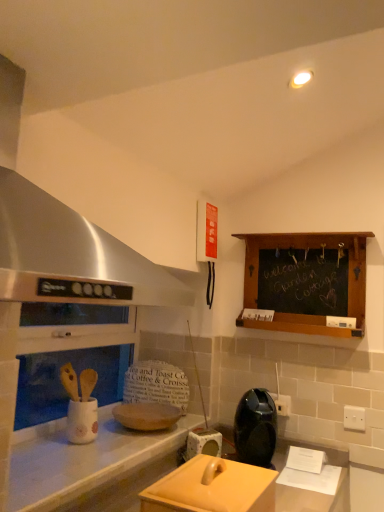
How much space does black plastic electric outlet at center-right, which appears as the second electric outlet when viewed from the right, occupy vertically?

black plastic electric outlet at center-right, which appears as the second electric outlet when viewed from the right, is 2.73 inches tall.

Describe the element at coordinates (282, 404) in the screenshot. I see `black plastic electric outlet at center-right, the first electric outlet in the back-to-front sequence` at that location.

How much space does white plastic electric outlet at upper right, the second electric outlet in the back-to-front sequence, occupy horizontally?

The width of white plastic electric outlet at upper right, the second electric outlet in the back-to-front sequence, is 0.89 inches.

What do you see at coordinates (354, 418) in the screenshot? I see `white plastic electric outlet at upper right, the second electric outlet in the back-to-front sequence` at bounding box center [354, 418].

What do you see at coordinates (255, 428) in the screenshot? I see `black glossy coffee maker at center, acting as the second appliance starting from the front` at bounding box center [255, 428].

Based on the photo, in order to face chalkboard wood at upper right, should I rotate leftwards or rightwards?

You should rotate right by 14.180 degrees.

At what (x,y) coordinates should I click in order to perform the action: click on chalkboard wood at upper right. Please return your answer as a coordinate pair (x, y). This screenshot has height=512, width=384. Looking at the image, I should click on (305, 281).

This screenshot has width=384, height=512. What do you see at coordinates (212, 488) in the screenshot? I see `matte yellow lid at center, the 3th appliance when ordered from back to front` at bounding box center [212, 488].

At what (x,y) coordinates should I click in order to perform the action: click on matte yellow lid at center, the 3th appliance when ordered from back to front. Please return your answer as a coordinate pair (x, y). This screenshot has width=384, height=512. Looking at the image, I should click on (212, 488).

Find the location of a particular element. black plastic electric outlet at center-right, the 2th electric outlet when ordered from front to back is located at coordinates (282, 404).

Which of these two, chalkboard wood at upper right or white plastic electric outlet at upper right, which ranks as the 1th electric outlet in front-to-back order, is bigger?

With larger size is chalkboard wood at upper right.

Considering the sizes of chalkboard wood at upper right and white plastic electric outlet at upper right, which ranks as the 1th electric outlet in front-to-back order, in the image, is chalkboard wood at upper right wider or thinner than white plastic electric outlet at upper right, which ranks as the 1th electric outlet in front-to-back order,?

Clearly, chalkboard wood at upper right has more width compared to white plastic electric outlet at upper right, which ranks as the 1th electric outlet in front-to-back order.

Would you say chalkboard wood at upper right is a long distance from white plastic electric outlet at upper right, the first electric outlet from the right?

chalkboard wood at upper right is near white plastic electric outlet at upper right, the first electric outlet from the right, not far away.

Is point (313, 262) closer to camera compared to point (361, 418)?

No, it is behind (361, 418).

Can you confirm if black plastic electric outlet at center-right, the first electric outlet in the back-to-front sequence, is shorter than matte beige toaster at center, arranged as the 1th appliance when viewed from the back?

Yes.

Considering the relative sizes of black plastic electric outlet at center-right, the 2th electric outlet when ordered from front to back, and matte beige toaster at center, arranged as the 1th appliance when viewed from the back, in the image provided, is black plastic electric outlet at center-right, the 2th electric outlet when ordered from front to back, wider than matte beige toaster at center, arranged as the 1th appliance when viewed from the back,?

No.

Based on the photo, from a real-world perspective, is black plastic electric outlet at center-right, positioned as the 1th electric outlet in left-to-right order, physically located above or below matte beige toaster at center, positioned as the 3th appliance in front-to-back order?

Clearly, from a real-world perspective, black plastic electric outlet at center-right, positioned as the 1th electric outlet in left-to-right order, is above matte beige toaster at center, positioned as the 3th appliance in front-to-back order.

Does point (286, 407) appear closer or farther from the camera than point (189, 436)?

Point (286, 407) is farther from the camera than point (189, 436).

Between white plastic electric outlet at upper right, the second electric outlet in the back-to-front sequence, and black glossy coffee maker at center, which is counted as the 2th appliance, starting from the back, which one is positioned behind?

white plastic electric outlet at upper right, the second electric outlet in the back-to-front sequence, is further away from the camera.

In the scene shown: Which is more to the left, white plastic electric outlet at upper right, the first electric outlet from the right, or black glossy coffee maker at center, acting as the second appliance starting from the front?

Positioned to the left is black glossy coffee maker at center, acting as the second appliance starting from the front.

From the image's perspective, between white plastic electric outlet at upper right, the first electric outlet from the right, and black glossy coffee maker at center, acting as the second appliance starting from the front, who is located below?

black glossy coffee maker at center, acting as the second appliance starting from the front.

Between matte yellow lid at center, which is the first appliance in front-to-back order, and black glossy coffee maker at center, acting as the second appliance starting from the front, which one has smaller size?

Smaller between the two is black glossy coffee maker at center, acting as the second appliance starting from the front.

Locate an element on the screen. The image size is (384, 512). appliance located in front of the black glossy coffee maker at center, which is counted as the 2th appliance, starting from the back is located at coordinates (212, 488).

Considering the relative sizes of matte yellow lid at center, which is the first appliance in front-to-back order, and black glossy coffee maker at center, acting as the second appliance starting from the front, in the image provided, is matte yellow lid at center, which is the first appliance in front-to-back order, wider than black glossy coffee maker at center, acting as the second appliance starting from the front,?

In fact, matte yellow lid at center, which is the first appliance in front-to-back order, might be narrower than black glossy coffee maker at center, acting as the second appliance starting from the front.

Who is more distant, matte yellow lid at center, the 3th appliance when ordered from back to front, or black glossy coffee maker at center, which is counted as the 2th appliance, starting from the back?

black glossy coffee maker at center, which is counted as the 2th appliance, starting from the back, is more distant.

Considering the relative sizes of black glossy coffee maker at center, which is counted as the 2th appliance, starting from the back, and chalkboard wood at upper right in the image provided, is black glossy coffee maker at center, which is counted as the 2th appliance, starting from the back, thinner than chalkboard wood at upper right?

In fact, black glossy coffee maker at center, which is counted as the 2th appliance, starting from the back, might be wider than chalkboard wood at upper right.

Which appliance is the 1st one when counting from the left side of the chalkboard wood at upper right? Please provide its 2D coordinates.

[(255, 428)]

Could chalkboard wood at upper right be considered to be inside black glossy coffee maker at center, which is counted as the 2th appliance, starting from the back?

Definitely not — chalkboard wood at upper right is not inside black glossy coffee maker at center, which is counted as the 2th appliance, starting from the back.

Is black glossy coffee maker at center, which is counted as the 2th appliance, starting from the back, far away from chalkboard wood at upper right?

black glossy coffee maker at center, which is counted as the 2th appliance, starting from the back, is actually quite close to chalkboard wood at upper right.

Is stainless steel exhaust hood at upper left positioned beyond the bounds of matte beige toaster at center, arranged as the 1th appliance when viewed from the back?

stainless steel exhaust hood at upper left is positioned outside matte beige toaster at center, arranged as the 1th appliance when viewed from the back.

Considering the sizes of objects stainless steel exhaust hood at upper left and matte beige toaster at center, positioned as the 3th appliance in front-to-back order, in the image provided, who is smaller, stainless steel exhaust hood at upper left or matte beige toaster at center, positioned as the 3th appliance in front-to-back order,?

matte beige toaster at center, positioned as the 3th appliance in front-to-back order.

Does stainless steel exhaust hood at upper left appear on the right side of matte beige toaster at center, arranged as the 1th appliance when viewed from the back?

Answer: Incorrect, stainless steel exhaust hood at upper left is not on the right side of matte beige toaster at center, arranged as the 1th appliance when viewed from the back.

Is stainless steel exhaust hood at upper left taller than matte beige toaster at center, arranged as the 1th appliance when viewed from the back?

Indeed, stainless steel exhaust hood at upper left has a greater height compared to matte beige toaster at center, arranged as the 1th appliance when viewed from the back.

Which object is wider, stainless steel exhaust hood at upper left or matte yellow lid at center, which is the first appliance in front-to-back order?

Wider between the two is stainless steel exhaust hood at upper left.

Who is bigger, stainless steel exhaust hood at upper left or matte yellow lid at center, which is the first appliance in front-to-back order?

With larger size is stainless steel exhaust hood at upper left.

Consider the image. From a real-world perspective, between stainless steel exhaust hood at upper left and matte yellow lid at center, the 3th appliance when ordered from back to front, who is vertically higher?

stainless steel exhaust hood at upper left.

Image resolution: width=384 pixels, height=512 pixels. I want to click on electric outlet that is the 2nd object located below the chalkboard wood at upper right (from the image's perspective), so (x=354, y=418).

The height and width of the screenshot is (512, 384). I want to click on electric outlet that is the 2nd object above the matte beige toaster at center, arranged as the 1th appliance when viewed from the back (from a real-world perspective), so click(x=282, y=404).

Looking at the image, which one is located closer to black plastic electric outlet at center-right, positioned as the 1th electric outlet in left-to-right order, white plastic electric outlet at upper right, the 2th electric outlet in the left-to-right sequence, or matte yellow lid at center, which is the first appliance in front-to-back order?

white plastic electric outlet at upper right, the 2th electric outlet in the left-to-right sequence, is positioned closer to the anchor black plastic electric outlet at center-right, positioned as the 1th electric outlet in left-to-right order.

Based on their spatial positions, is stainless steel exhaust hood at upper left or matte beige toaster at center, positioned as the 3th appliance in front-to-back order, further from black glossy coffee maker at center, acting as the second appliance starting from the front?

→ The object further to black glossy coffee maker at center, acting as the second appliance starting from the front, is stainless steel exhaust hood at upper left.

Looking at the image, which one is located further to matte beige toaster at center, positioned as the 3th appliance in front-to-back order, matte yellow lid at center, the 3th appliance when ordered from back to front, or black glossy coffee maker at center, which is counted as the 2th appliance, starting from the back?

Based on the image, matte yellow lid at center, the 3th appliance when ordered from back to front, appears to be further to matte beige toaster at center, positioned as the 3th appliance in front-to-back order.

Which object lies nearer to the anchor point stainless steel exhaust hood at upper left, chalkboard wood at upper right or matte yellow lid at center, which is the first appliance in front-to-back order?

Among the two, matte yellow lid at center, which is the first appliance in front-to-back order, is located nearer to stainless steel exhaust hood at upper left.

Which object lies nearer to the anchor point chalkboard wood at upper right, black glossy coffee maker at center, which is counted as the 2th appliance, starting from the back, or black plastic electric outlet at center-right, positioned as the 1th electric outlet in left-to-right order?

Based on the image, black glossy coffee maker at center, which is counted as the 2th appliance, starting from the back, appears to be nearer to chalkboard wood at upper right.

Estimate the real-world distances between objects in this image. Which object is closer to matte yellow lid at center, which is the first appliance in front-to-back order, stainless steel exhaust hood at upper left or white plastic electric outlet at upper right, the second electric outlet in the back-to-front sequence?

Among the two, stainless steel exhaust hood at upper left is located nearer to matte yellow lid at center, which is the first appliance in front-to-back order.

Looking at this image, estimate the real-world distances between objects in this image. Which object is closer to matte yellow lid at center, which is the first appliance in front-to-back order, black plastic electric outlet at center-right, the 2th electric outlet when ordered from front to back, or stainless steel exhaust hood at upper left?

Based on the image, stainless steel exhaust hood at upper left appears to be nearer to matte yellow lid at center, which is the first appliance in front-to-back order.

When comparing their distances from black plastic electric outlet at center-right, the 2th electric outlet when ordered from front to back, does black glossy coffee maker at center, which is counted as the 2th appliance, starting from the back, or chalkboard wood at upper right seem closer?

black glossy coffee maker at center, which is counted as the 2th appliance, starting from the back, lies closer to black plastic electric outlet at center-right, the 2th electric outlet when ordered from front to back, than the other object.

Where is `cabinetry between matte yellow lid at center, the 3th appliance when ordered from back to front, and black plastic electric outlet at center-right, the first electric outlet in the back-to-front sequence, in the front-back direction`? The height and width of the screenshot is (512, 384). cabinetry between matte yellow lid at center, the 3th appliance when ordered from back to front, and black plastic electric outlet at center-right, the first electric outlet in the back-to-front sequence, in the front-back direction is located at coordinates (305, 281).

Image resolution: width=384 pixels, height=512 pixels. I want to click on electric outlet between chalkboard wood at upper right and white plastic electric outlet at upper right, the second electric outlet in the back-to-front sequence, in the up-down direction, so click(x=282, y=404).

The image size is (384, 512). Find the location of `electric outlet between stainless steel exhaust hood at upper left and black plastic electric outlet at center-right, the 2th electric outlet when ordered from front to back, along the z-axis`. electric outlet between stainless steel exhaust hood at upper left and black plastic electric outlet at center-right, the 2th electric outlet when ordered from front to back, along the z-axis is located at coordinates (354, 418).

At what (x,y) coordinates should I click in order to perform the action: click on appliance between stainless steel exhaust hood at upper left and black glossy coffee maker at center, which is counted as the 2th appliance, starting from the back, from front to back. Please return your answer as a coordinate pair (x, y). This screenshot has height=512, width=384. Looking at the image, I should click on (212, 488).